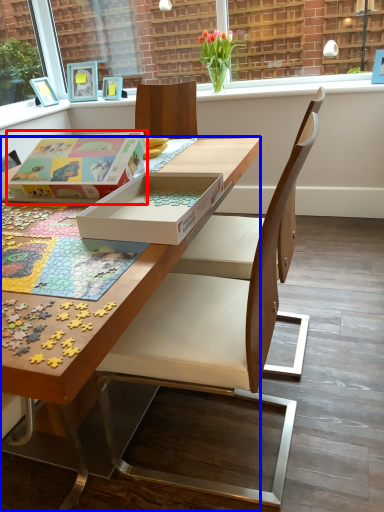
Question: Which object is further to the camera taking this photo, cardboard box (highlighted by a red box) or desk (highlighted by a blue box)?

Choices:
 (A) cardboard box
 (B) desk

Answer: (A)